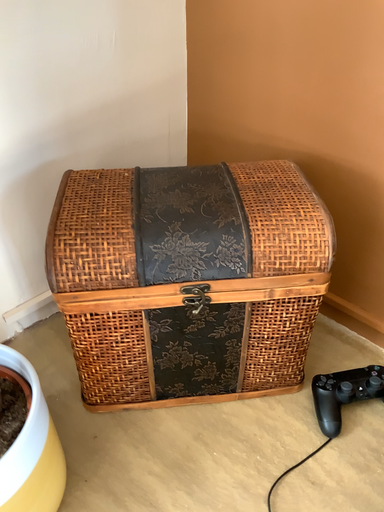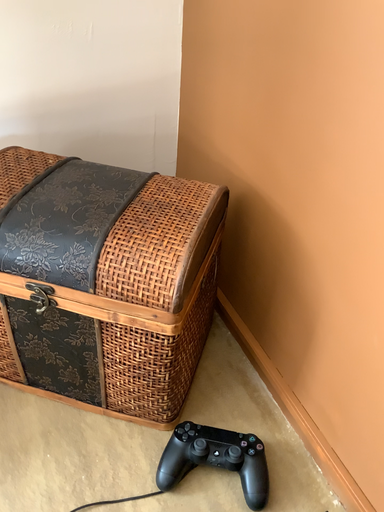
Question: Which way did the camera rotate in the video?

Choices:
 (A) rotated left
 (B) rotated right

Answer: (A)